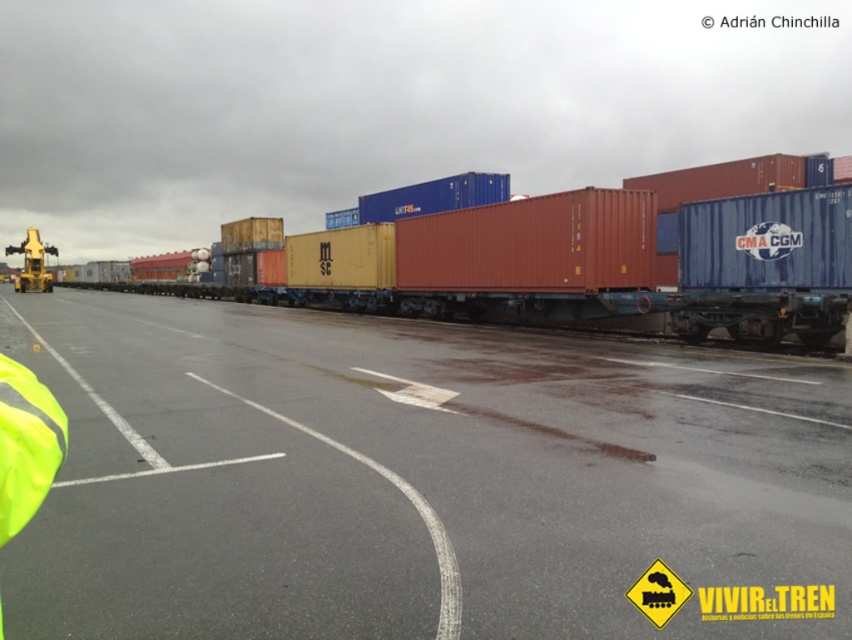
Question: Based on their relative distances, which object is nearer to the blue matte container at center-right?

Choices:
 (A) red matte container at center
 (B) matte red container at center
 (C) yellow reflective safety vest at lower left

Answer: (B)

Question: Does red matte container at center appear under matte red container at center?

Choices:
 (A) yes
 (B) no

Answer: (B)

Question: Can you confirm if blue matte container at center-right is positioned above yellow reflective safety vest at lower left?

Choices:
 (A) yes
 (B) no

Answer: (A)

Question: Which object is closer to the camera taking this photo?

Choices:
 (A) matte red container at center
 (B) yellow reflective safety vest at lower left
 (C) red matte container at center

Answer: (B)

Question: Is blue matte container at center-right further to camera compared to yellow reflective safety vest at lower left?

Choices:
 (A) no
 (B) yes

Answer: (B)

Question: Which of the following is the farthest from the observer?

Choices:
 (A) (543, 214)
 (B) (845, 308)
 (C) (818, 243)
 (D) (44, 496)

Answer: (A)